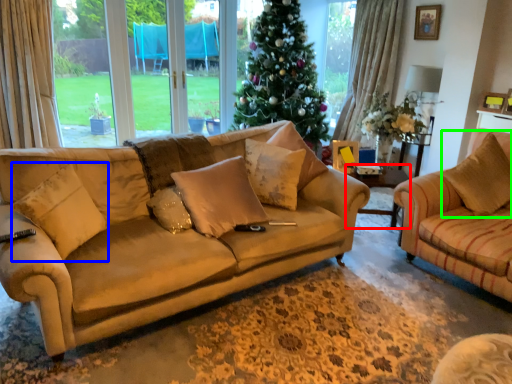
Question: Which object is positioned farthest from side table (highlighted by a red box)? Select from pillow (highlighted by a blue box) and pillow (highlighted by a green box).

Choices:
 (A) pillow
 (B) pillow

Answer: (A)